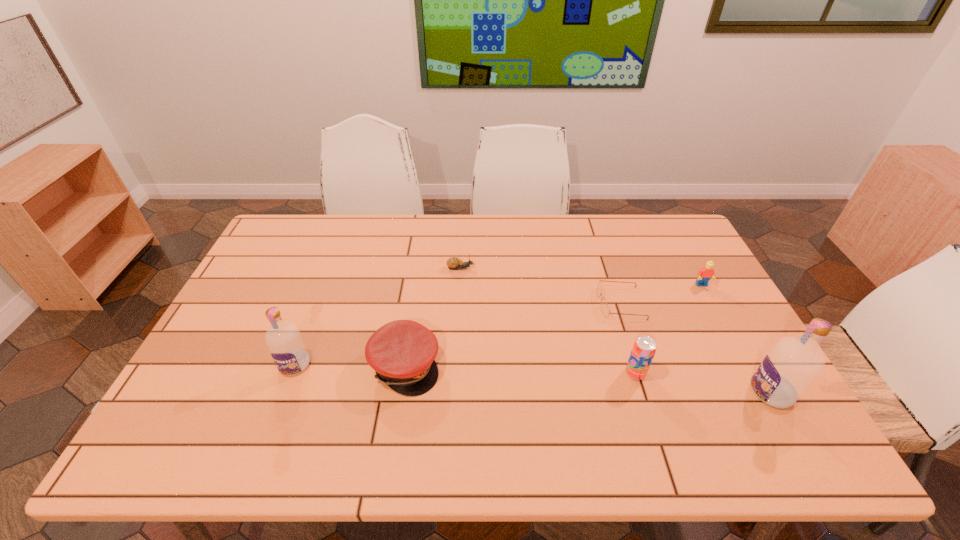
Image resolution: width=960 pixels, height=540 pixels. What are the coordinates of `vacant space at the far right corner of the desktop` in the screenshot? It's located at (640, 225).

Identify the location of empty location between the cap and the spectacles. (513, 335).

Identify the location of vacant space in between the shorter vodka and the third tallest object. The image size is (960, 540). (466, 369).

Find the location of `vacant space that is in between the shortest object and the soda can`. vacant space that is in between the shortest object and the soda can is located at coordinates pyautogui.click(x=628, y=338).

In order to click on empty location between the spectacles and the right vodka in this screenshot , I will do `click(696, 348)`.

Find the location of a particular element. The image size is (960, 540). vacant space that's between the shortest object and the Lego is located at coordinates (660, 294).

Identify the location of empty space between the cap and the escargot. (433, 317).

What are the coordinates of `vacant area between the leftmost object and the escargot` in the screenshot? It's located at (378, 316).

Where is `unoccupied position between the spectacles and the left vodka`? The height and width of the screenshot is (540, 960). unoccupied position between the spectacles and the left vodka is located at coordinates (458, 334).

Find the location of a particular element. vacant point located between the second tallest object and the cap is located at coordinates (349, 366).